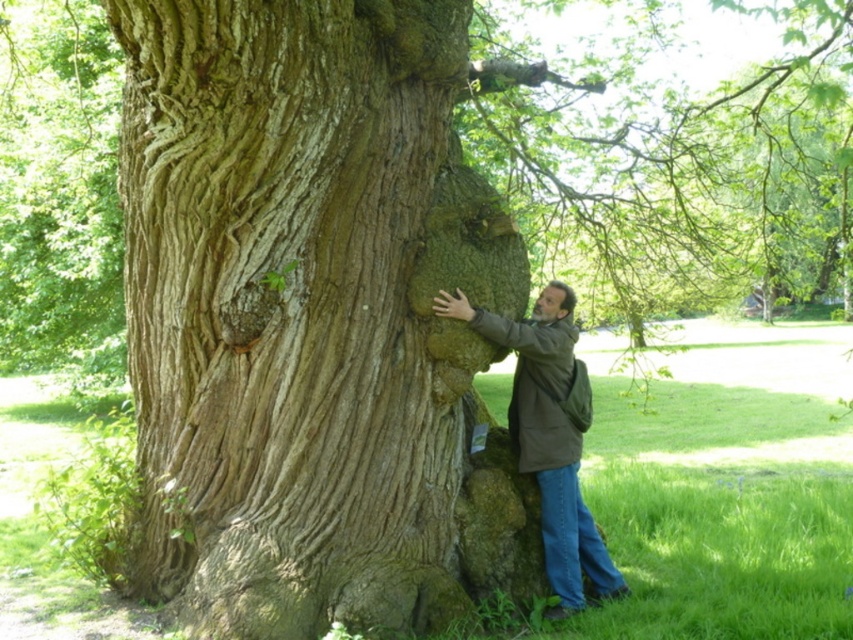
Describe the element at coordinates (312, 317) in the screenshot. This screenshot has width=853, height=640. I see `rough bark tree trunk at center` at that location.

This screenshot has width=853, height=640. I want to click on rough bark tree trunk at center, so click(312, 317).